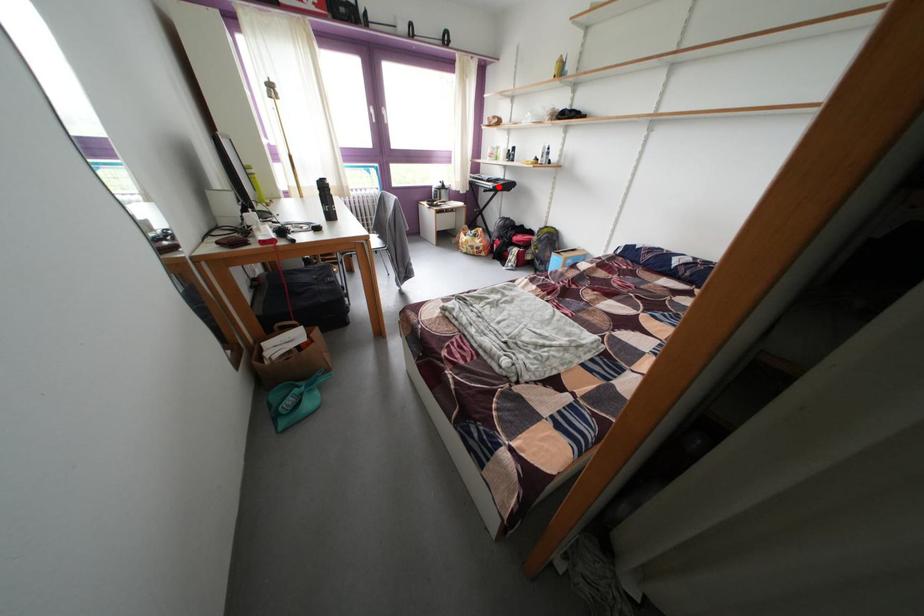
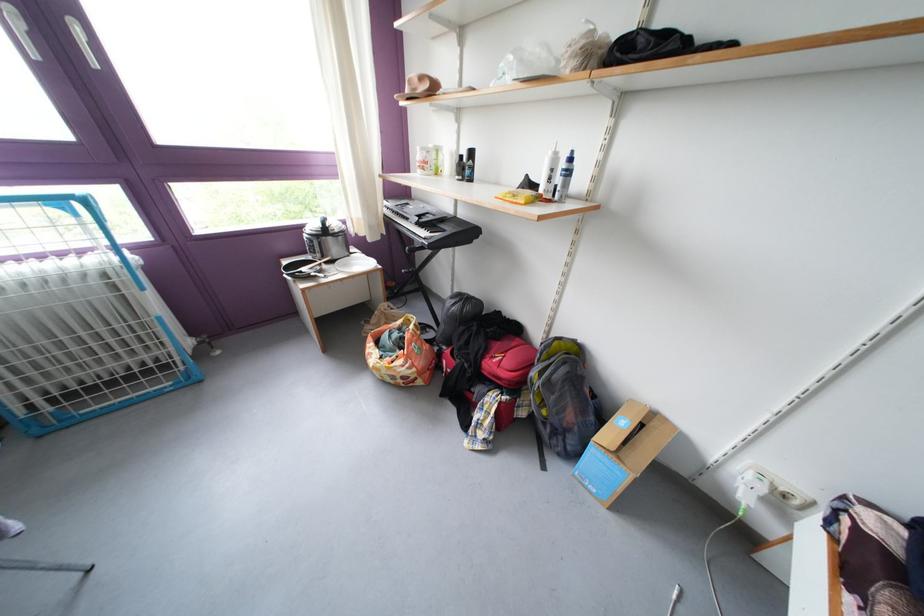
Find the pixel in the second image that matches the highlighted location in the first image.

(430, 229)